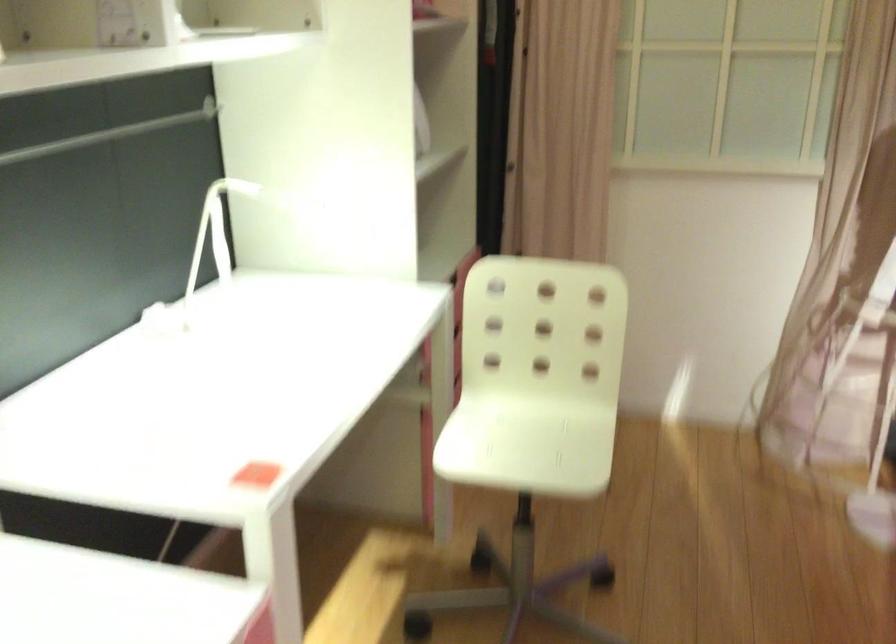
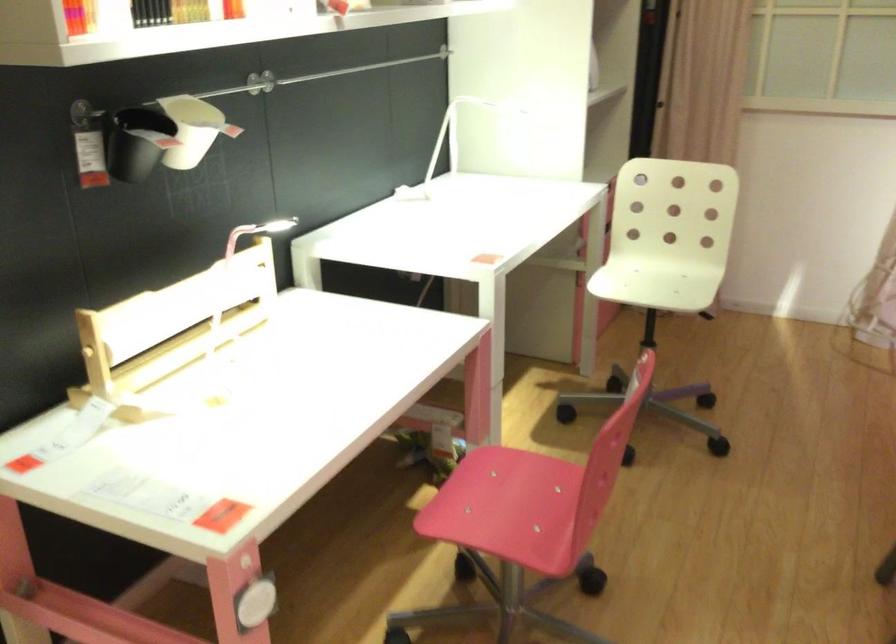
Question: The images are taken continuously from a first-person perspective. In which direction are you moving?

Choices:
 (A) Left
 (B) Right
 (C) Forward
 (D) Backward

Answer: (D)